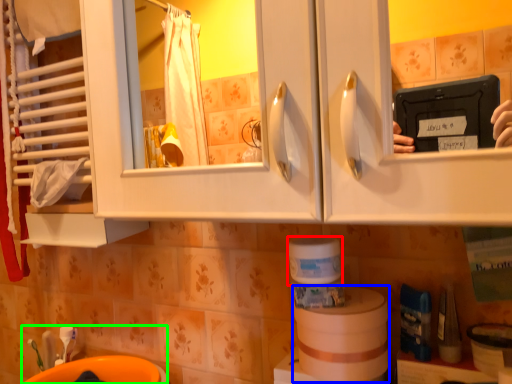
Question: Which object is positioned closest to toilet paper (highlighted by a red box)? Select from toilet paper (highlighted by a blue box) and sink (highlighted by a green box).

Choices:
 (A) toilet paper
 (B) sink

Answer: (A)